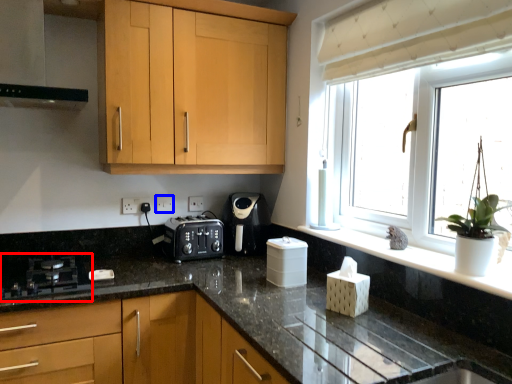
Question: Which object appears closest to the camera in this image, gas stove (highlighted by a red box) or electric outlet (highlighted by a blue box)?

Choices:
 (A) gas stove
 (B) electric outlet

Answer: (A)